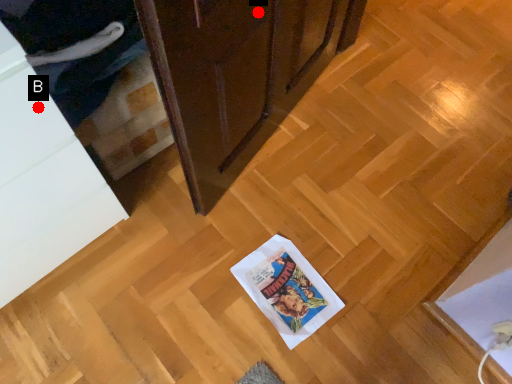
Question: Two points are circled on the image, labeled by A and B beside each circle. Which point appears closest to the camera in this image?

Choices:
 (A) A is closer
 (B) B is closer

Answer: (B)